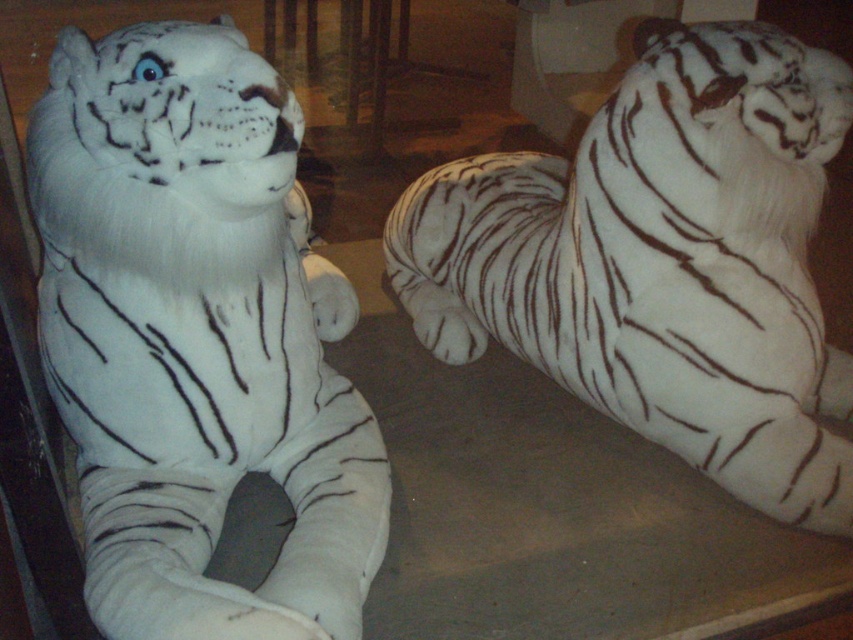
Is white plush tiger at left shorter than white plush tiger at right?

Yes.

Locate an element on the screen. white plush tiger at left is located at coordinates (196, 337).